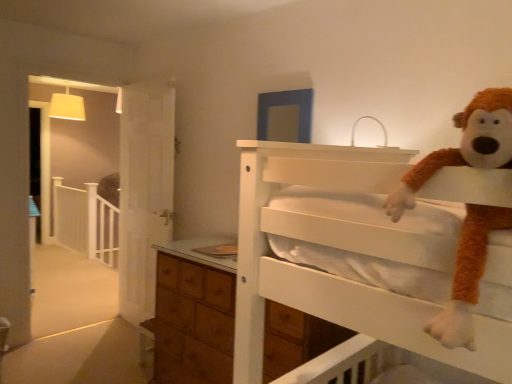
Identify the location of brown furry monkey at upper right. The height and width of the screenshot is (384, 512). (464, 147).

Describe the element at coordinates (464, 147) in the screenshot. I see `brown furry monkey at upper right` at that location.

What do you see at coordinates (85, 222) in the screenshot?
I see `white wooden balustrade at left` at bounding box center [85, 222].

You are a GUI agent. You are given a task and a screenshot of the screen. Output one action in this format:
    pyautogui.click(x=<x>, y=<y>)
    Task: Click on the white wooden balustrade at left
    The height and width of the screenshot is (384, 512).
    Given the screenshot: What is the action you would take?
    pyautogui.click(x=85, y=222)

The height and width of the screenshot is (384, 512). Find the location of `brown furry monkey at upper right`. brown furry monkey at upper right is located at coordinates (464, 147).

Does brown furry monkey at upper right appear on the left side of white wooden balustrade at left?

Incorrect, brown furry monkey at upper right is not on the left side of white wooden balustrade at left.

Which object is further away from the camera taking this photo, brown furry monkey at upper right or white wooden balustrade at left?

white wooden balustrade at left is more distant.

Considering the points (447, 326) and (110, 239), which point is behind, point (447, 326) or point (110, 239)?

The point (110, 239) is behind.

From the image's perspective, which one is positioned lower, brown furry monkey at upper right or white wooden balustrade at left?

white wooden balustrade at left appears lower in the image.

From a real-world perspective, is brown furry monkey at upper right above or below white wooden balustrade at left?

From a real-world perspective, brown furry monkey at upper right is physically above white wooden balustrade at left.

Considering the relative sizes of brown furry monkey at upper right and white wooden balustrade at left in the image provided, is brown furry monkey at upper right thinner than white wooden balustrade at left?

Incorrect, the width of brown furry monkey at upper right is not less than that of white wooden balustrade at left.

Is brown furry monkey at upper right shorter than white wooden balustrade at left?

Yes, brown furry monkey at upper right is shorter than white wooden balustrade at left.

Can you confirm if brown furry monkey at upper right is bigger than white wooden balustrade at left?

No, brown furry monkey at upper right is not bigger than white wooden balustrade at left.

Would you say brown furry monkey at upper right is inside or outside white wooden balustrade at left?

brown furry monkey at upper right is not enclosed by white wooden balustrade at left.

Is brown furry monkey at upper right next to white wooden balustrade at left and touching it?

No, brown furry monkey at upper right is not touching white wooden balustrade at left.

Is white wooden balustrade at left at the back of brown furry monkey at upper right?

brown furry monkey at upper right is not turned away from white wooden balustrade at left.

How different are the orientations of brown furry monkey at upper right and white wooden balustrade at left in degrees?

2.27 degrees.

Locate an element on the screen. The image size is (512, 384). balustrade below the brown furry monkey at upper right (from a real-world perspective) is located at coordinates (85, 222).

Which is more to the right, white wooden balustrade at left or brown furry monkey at upper right?

brown furry monkey at upper right.

Consider the image. Which object is closer to the camera taking this photo, white wooden balustrade at left or brown furry monkey at upper right?

brown furry monkey at upper right is more forward.

Is point (69, 215) positioned before point (413, 186)?

No, (69, 215) is further to viewer.

From the image's perspective, is white wooden balustrade at left above brown furry monkey at upper right?

Actually, white wooden balustrade at left appears below brown furry monkey at upper right in the image.

From a real-world perspective, is white wooden balustrade at left on brown furry monkey at upper right?

No.

Consider the image. Is white wooden balustrade at left thinner than brown furry monkey at upper right?

Yes.

Does white wooden balustrade at left have a greater height compared to brown furry monkey at upper right?

Yes.

Does white wooden balustrade at left have a larger size compared to brown furry monkey at upper right?

Yes, white wooden balustrade at left is bigger than brown furry monkey at upper right.

Can brown furry monkey at upper right be found inside white wooden balustrade at left?

That's incorrect, brown furry monkey at upper right is not inside white wooden balustrade at left.

Is white wooden balustrade at left positioned far away from brown furry monkey at upper right?

That's right, there is a large distance between white wooden balustrade at left and brown furry monkey at upper right.

Is brown furry monkey at upper right at the back of white wooden balustrade at left?

No, white wooden balustrade at left's orientation is not away from brown furry monkey at upper right.

Measure the distance between white wooden balustrade at left and brown furry monkey at upper right.

5.64 meters.

Identify the location of balustrade on the left side of brown furry monkey at upper right. The image size is (512, 384). (85, 222).

The width and height of the screenshot is (512, 384). Identify the location of balustrade below the brown furry monkey at upper right (from a real-world perspective). (85, 222).

Where is `balustrade located below the brown furry monkey at upper right (from the image's perspective)`? balustrade located below the brown furry monkey at upper right (from the image's perspective) is located at coordinates (85, 222).